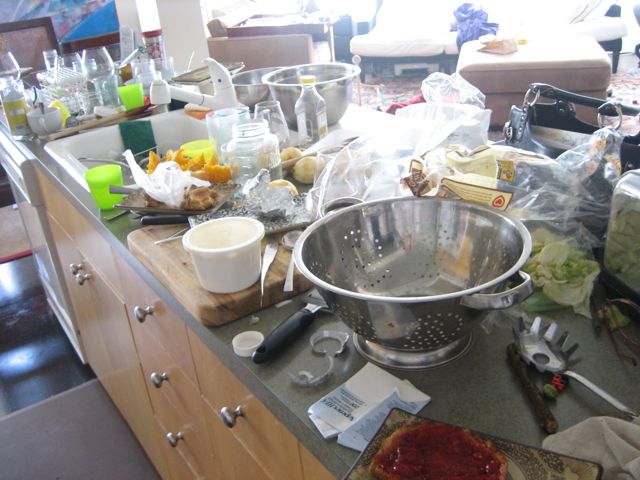
Where is `rug`? rug is located at coordinates (108, 433), (17, 223), (401, 88), (628, 85), (628, 267).